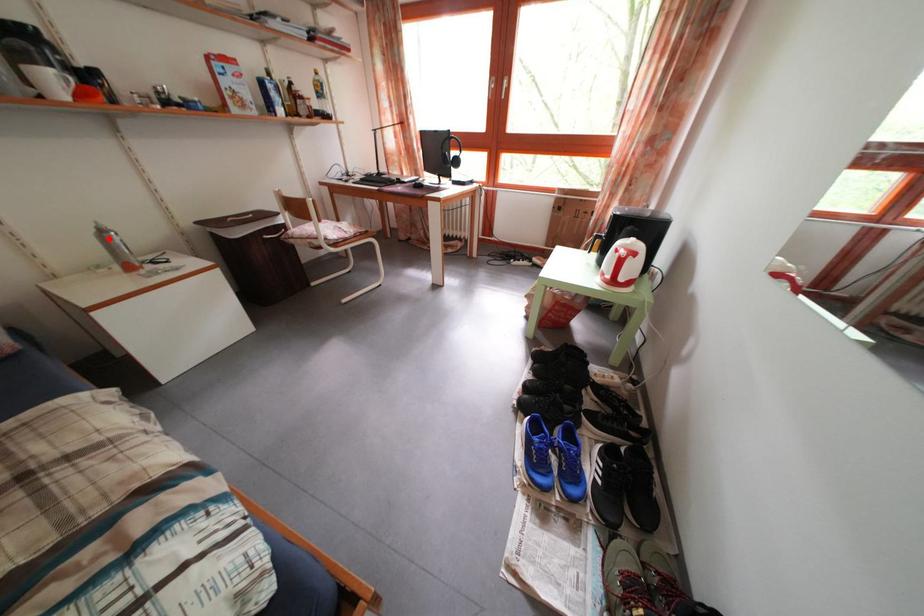
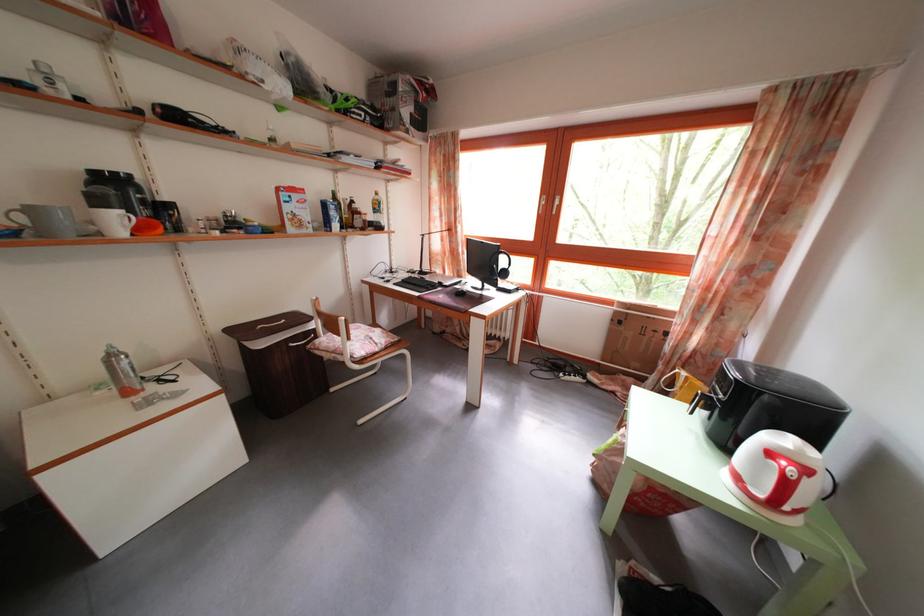
Question: I am providing you with two images of the same scene from different viewpoints. A red point is marked on the first image. Is the red point's position out of view in image 2?

Choices:
 (A) Yes
 (B) No

Answer: (B)